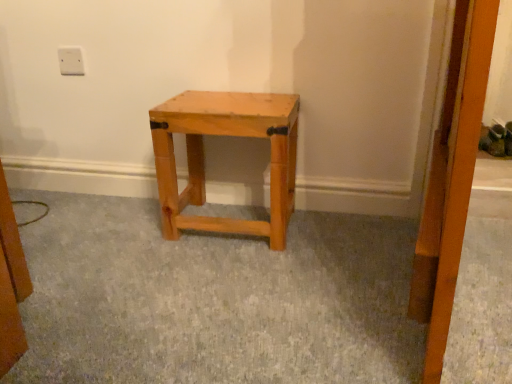
I want to click on vacant space underneath natural wood stool at center (from a real-world perspective), so click(x=234, y=210).